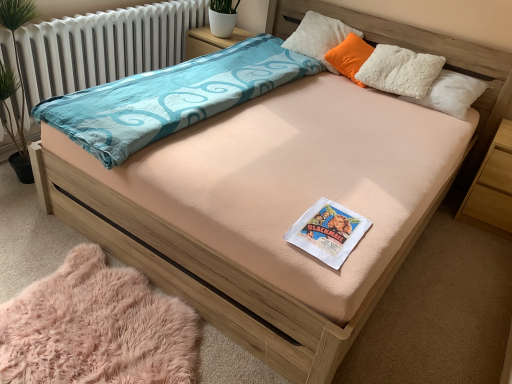
At what (x,y) coordinates should I click in order to perform the action: click on white paper book at center. Please return your answer as a coordinate pair (x, y). This screenshot has height=384, width=512. Looking at the image, I should click on tap(328, 232).

Measure the distance between white fluffy pillow at upper right, which appears as the first pillow when viewed from the top, and camera.

white fluffy pillow at upper right, which appears as the first pillow when viewed from the top, is 9.31 feet away from camera.

Locate an element on the screen. orange soft pillow at upper right, the 2th pillow from the top is located at coordinates (350, 57).

Is pink fluffy rug at lower left at the back of orange soft pillow at upper right, the 2th pillow from the top?

orange soft pillow at upper right, the 2th pillow from the top, does not have its back to pink fluffy rug at lower left.

The height and width of the screenshot is (384, 512). Identify the location of blanket below the orange soft pillow at upper right, the 2th pillow from the top (from a real-world perspective). (97, 328).

Considering the relative sizes of orange soft pillow at upper right, which appears as the first pillow when ordered from the bottom, and pink fluffy rug at lower left in the image provided, is orange soft pillow at upper right, which appears as the first pillow when ordered from the bottom, thinner than pink fluffy rug at lower left?

Yes.

Is pink fluffy rug at lower left oriented away from white paper book at center?

No, pink fluffy rug at lower left is not facing away from white paper book at center.

How distant is pink fluffy rug at lower left from white paper book at center?

A distance of 31.63 inches exists between pink fluffy rug at lower left and white paper book at center.

Image resolution: width=512 pixels, height=384 pixels. What are the coordinates of `book lying on the right of pink fluffy rug at lower left` in the screenshot? It's located at (328, 232).

Is white radiator at upper left oriented away from light brown wood at right?

No.

Based on the photo, can you tell me how much white radiator at upper left and light brown wood at right differ in facing direction?

The angle between the facing direction of white radiator at upper left and the facing direction of light brown wood at right is 0.388 degrees.

Considering the sizes of white radiator at upper left and light brown wood at right in the image, is white radiator at upper left taller or shorter than light brown wood at right?

white radiator at upper left is taller than light brown wood at right.

Is the position of white radiator at upper left less distant than that of light brown wood at right?

Yes, the depth of white radiator at upper left is less than that of light brown wood at right.

Based on the photo, from a real-world perspective, does white radiator at upper left sit lower than white paper book at center?

Yes, from a real-world perspective, white radiator at upper left is below white paper book at center.

The width and height of the screenshot is (512, 384). Identify the location of book that is above the white radiator at upper left (from a real-world perspective). (328, 232).

Between white radiator at upper left and white paper book at center, which one has smaller size?

Smaller between the two is white paper book at center.

Considering the sizes of white radiator at upper left and white paper book at center in the image, is white radiator at upper left wider or thinner than white paper book at center?

In the image, white radiator at upper left appears to be wider than white paper book at center.

From a real-world perspective, is white paper book at center on orange soft pillow at upper right, which appears as the first pillow when ordered from the bottom?

Actually, white paper book at center is physically below orange soft pillow at upper right, which appears as the first pillow when ordered from the bottom, in the real world.

Which point is more forward, (328,203) or (366,58)?

The point (328,203) is in front.

How much distance is there between white paper book at center and orange soft pillow at upper right, which appears as the first pillow when ordered from the bottom?

white paper book at center is 5.28 feet away from orange soft pillow at upper right, which appears as the first pillow when ordered from the bottom.

Which of these two, white paper book at center or orange soft pillow at upper right, the 2th pillow from the top, is smaller?

Smaller between the two is white paper book at center.

Identify the location of book on the left of white fluffy pillow at upper right, which is the second pillow in bottom-to-top order. Image resolution: width=512 pixels, height=384 pixels. (x=328, y=232).

Does point (333, 225) lie behind point (300, 34)?

That is False.

Considering the positions of objects white paper book at center and white fluffy pillow at upper right, which appears as the first pillow when viewed from the top, in the image provided, who is in front, white paper book at center or white fluffy pillow at upper right, which appears as the first pillow when viewed from the top,?

white paper book at center.

Measure the distance between white paper book at center and white fluffy pillow at upper right, which is the second pillow in bottom-to-top order.

The distance of white paper book at center from white fluffy pillow at upper right, which is the second pillow in bottom-to-top order, is 1.75 meters.

Can you confirm if white radiator at upper left is wider than white fluffy pillow at upper right, which appears as the first pillow when viewed from the top?

Indeed, white radiator at upper left has a greater width compared to white fluffy pillow at upper right, which appears as the first pillow when viewed from the top.

Which point is more forward, (73, 18) or (317, 25)?

The point (73, 18) is more forward.

Is white radiator at upper left oriented towards white fluffy pillow at upper right, which is the second pillow in bottom-to-top order?

No, white radiator at upper left does not turn towards white fluffy pillow at upper right, which is the second pillow in bottom-to-top order.

Between white radiator at upper left and white fluffy pillow at upper right, which appears as the first pillow when viewed from the top, which one is positioned behind?

white fluffy pillow at upper right, which appears as the first pillow when viewed from the top, is more distant.

Which pillow is the 2nd one when counting from the right side of the pink fluffy rug at lower left? Please provide its 2D coordinates.

[(350, 57)]

What are the coordinates of `blanket below the white paper book at center (from a real-world perspective)` in the screenshot? It's located at (97, 328).

From the image, which object appears to be nearer to white radiator at upper left, orange soft pillow at upper right, the 2th pillow from the top, or white fluffy pillow at upper right, which appears as the first pillow when viewed from the top?

The object closer to white radiator at upper left is white fluffy pillow at upper right, which appears as the first pillow when viewed from the top.

Based on their spatial positions, is white radiator at upper left or light brown wood at right closer to white paper book at center?

light brown wood at right.

Based on their spatial positions, is light brown wood at right or pink fluffy rug at lower left closer to white radiator at upper left?

The object closer to white radiator at upper left is pink fluffy rug at lower left.

Considering their positions, is white fluffy pillow at upper right, which is the second pillow in bottom-to-top order, positioned closer to white paper book at center than white radiator at upper left?

white fluffy pillow at upper right, which is the second pillow in bottom-to-top order, lies closer to white paper book at center than the other object.

Based on their spatial positions, is white radiator at upper left or white paper book at center further from white fluffy pillow at upper right, which is the second pillow in bottom-to-top order?

white paper book at center.

Estimate the real-world distances between objects in this image. Which object is further from light brown wood at right, orange soft pillow at upper right, which appears as the first pillow when ordered from the bottom, or white radiator at upper left?

Among the two, white radiator at upper left is located further to light brown wood at right.

When comparing their distances from light brown wood at right, does white fluffy pillow at upper right, which is the second pillow in bottom-to-top order, or orange soft pillow at upper right, the 2th pillow from the top, seem further?

white fluffy pillow at upper right, which is the second pillow in bottom-to-top order, lies further to light brown wood at right than the other object.

Looking at the image, which one is located closer to pink fluffy rug at lower left, white radiator at upper left or orange soft pillow at upper right, which appears as the first pillow when ordered from the bottom?

Among the two, white radiator at upper left is located nearer to pink fluffy rug at lower left.

You are a GUI agent. You are given a task and a screenshot of the screen. Output one action in this format:
    pyautogui.click(x=<x>, y=<y>)
    Task: Click on the book between orange soft pillow at upper right, which appears as the first pillow when ordered from the bottom, and pink fluffy rug at lower left, in the vertical direction
    The width and height of the screenshot is (512, 384).
    Given the screenshot: What is the action you would take?
    pyautogui.click(x=328, y=232)

The width and height of the screenshot is (512, 384). In order to click on book between white radiator at upper left and pink fluffy rug at lower left from top to bottom in this screenshot , I will do click(328, 232).

Identify the location of book located between white radiator at upper left and white fluffy pillow at upper right, which appears as the first pillow when viewed from the top, in the left-right direction. This screenshot has width=512, height=384. coord(328,232).

Locate an element on the screen. This screenshot has width=512, height=384. pillow that lies between white fluffy pillow at upper right, which is the second pillow in bottom-to-top order, and pink fluffy rug at lower left from top to bottom is located at coordinates (350, 57).